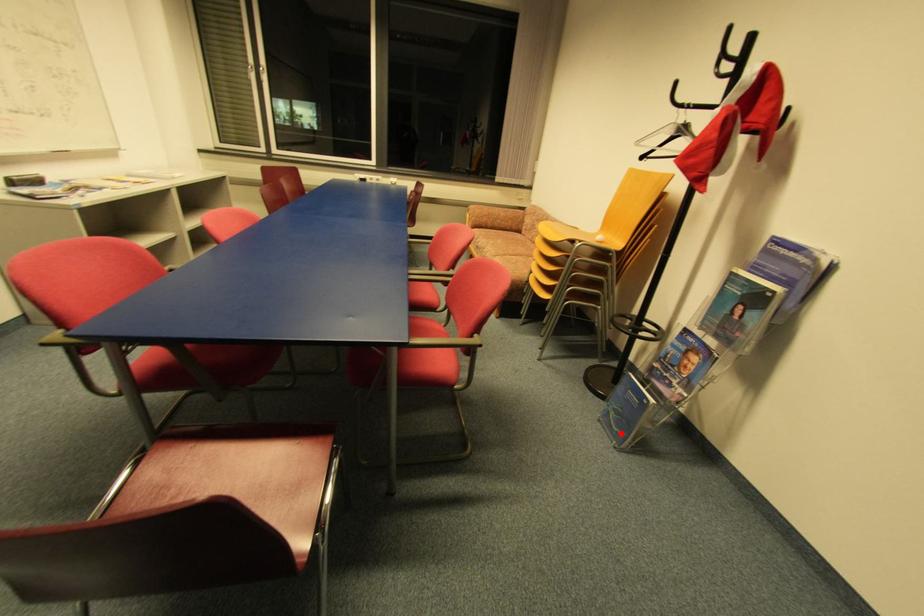
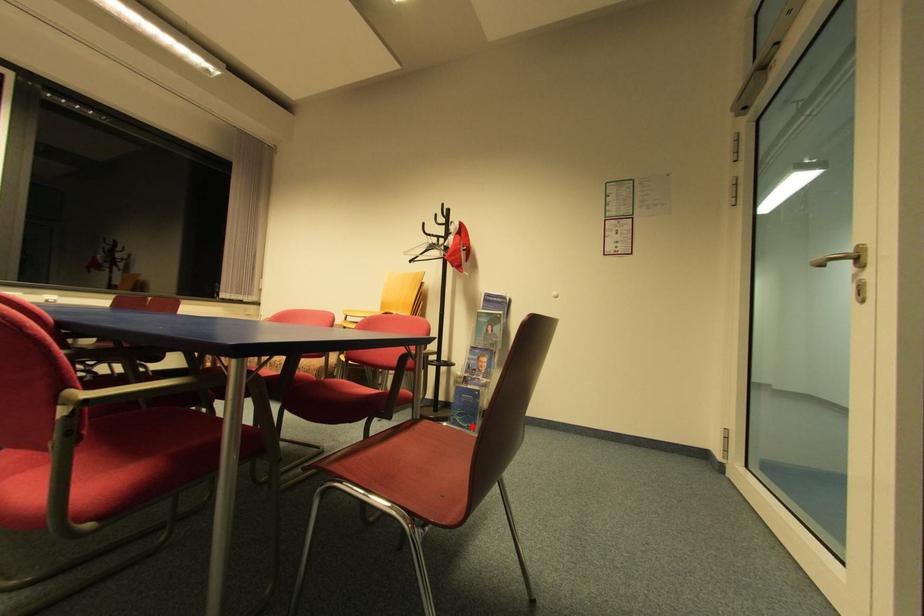
I am providing you with two images of the same scene from different viewpoints. A red point is marked on the first image and another point is marked on the second image. Does the point marked in image1 correspond to the same location as the one in image2?

Yes